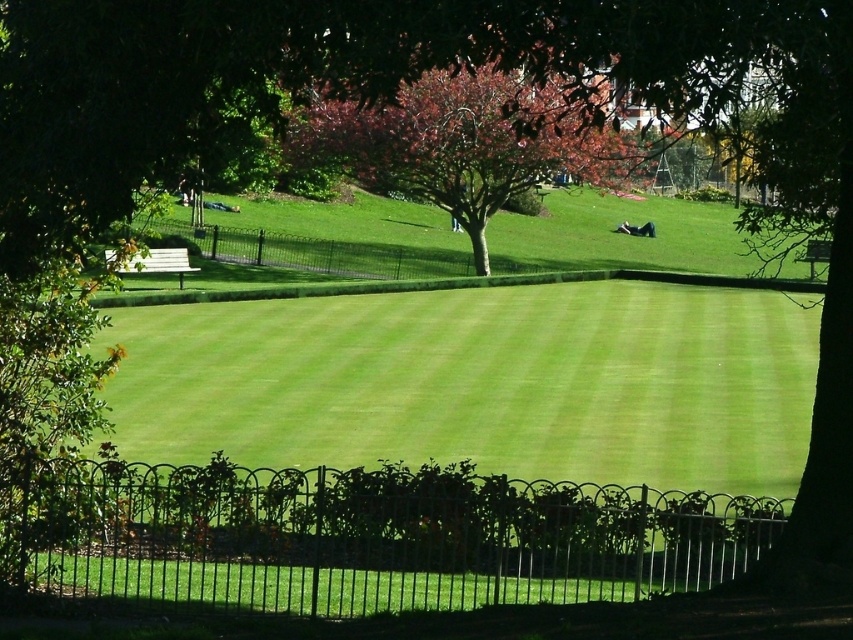
Question: Which point appears farthest from the camera in this image?

Choices:
 (A) (618, 225)
 (B) (811, 259)

Answer: (A)

Question: Considering the real-world distances, which object is farthest from the smooth pinkish-red tree at center?

Choices:
 (A) black matte person at center
 (B) wooden park bench at lower right
 (C) white wooden bench at left

Answer: (A)

Question: Which point is farther from the camera taking this photo?

Choices:
 (A) (392, 100)
 (B) (819, 241)

Answer: (B)

Question: Can you confirm if green smooth lawn at center is positioned below wooden park bench at lower right?

Choices:
 (A) yes
 (B) no

Answer: (A)

Question: Can you confirm if green smooth lawn at center is thinner than black matte person at center?

Choices:
 (A) no
 (B) yes

Answer: (A)

Question: Is white wooden bench at left to the right of wooden park bench at lower right from the viewer's perspective?

Choices:
 (A) no
 (B) yes

Answer: (A)